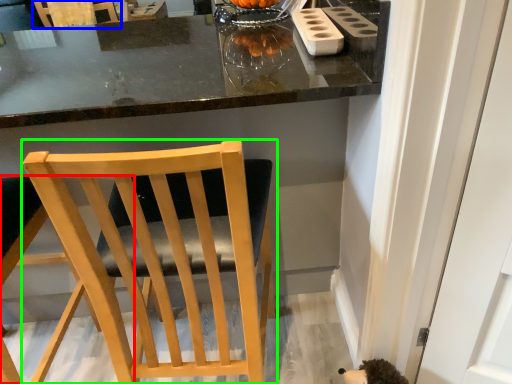
Question: Which object is positioned closest to chair (highlighted by a red box)? Select from chair (highlighted by a blue box) and chair (highlighted by a green box).

Choices:
 (A) chair
 (B) chair

Answer: (B)